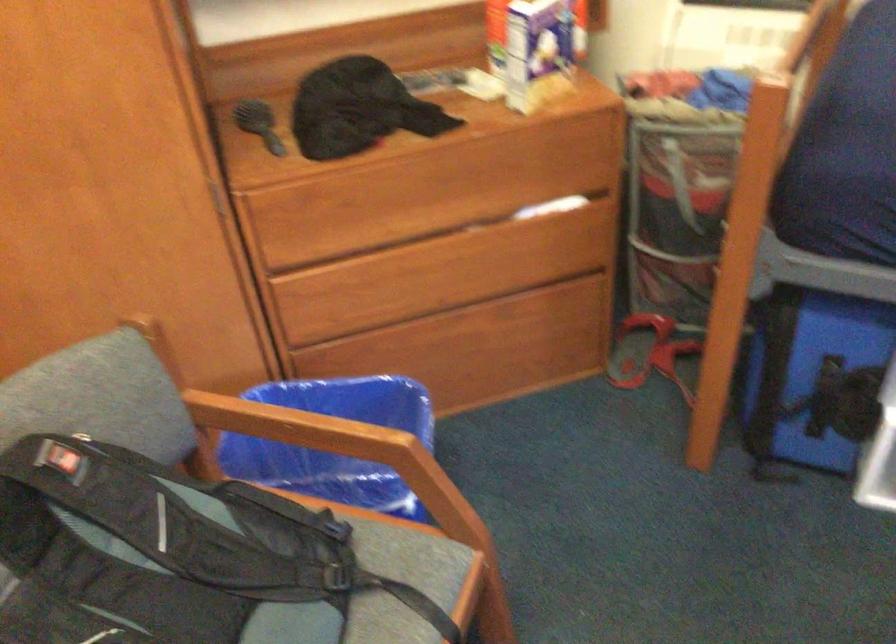
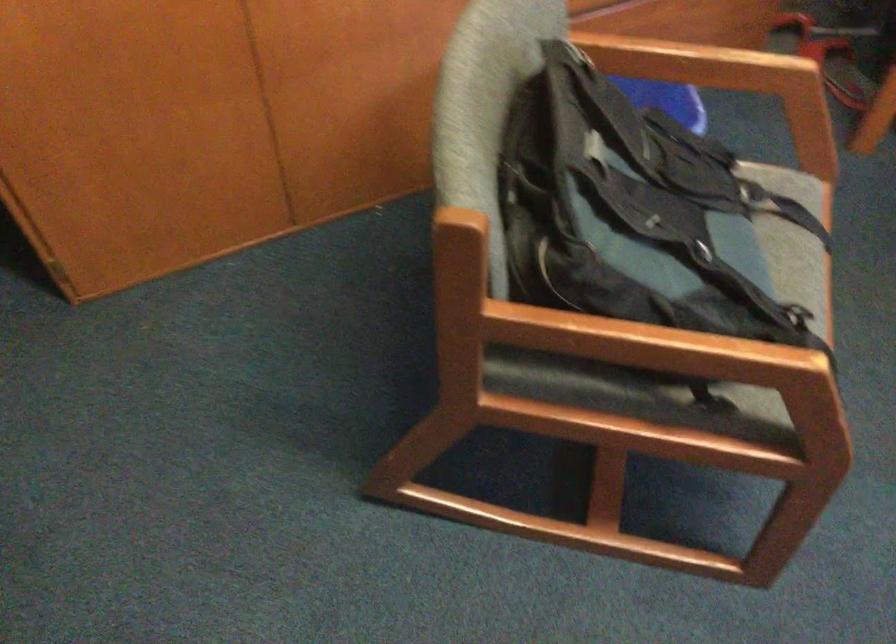
Question: The images are taken continuously from a first-person perspective. In which direction is your viewpoint rotating?

Choices:
 (A) Left
 (B) Right
 (C) Up
 (D) Down

Answer: (D)